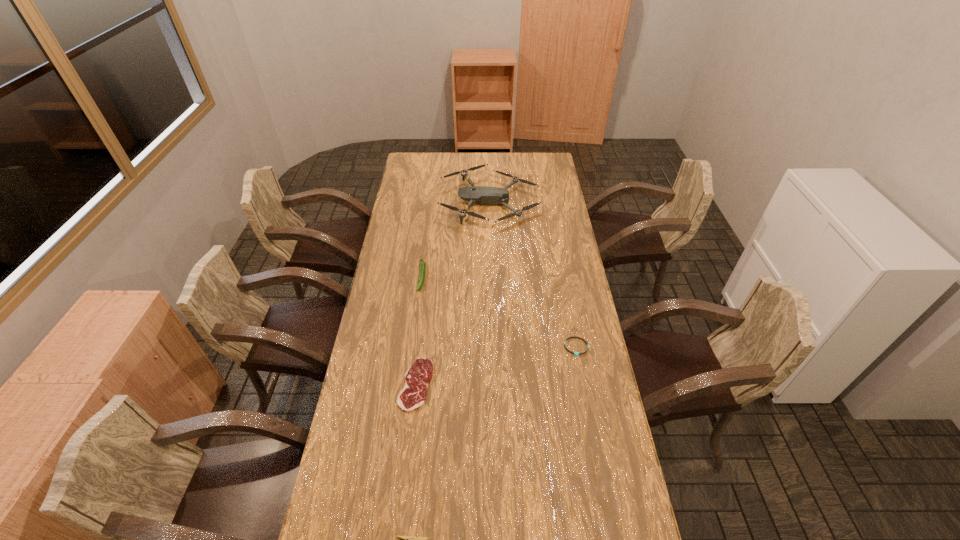
The width and height of the screenshot is (960, 540). I want to click on drone, so click(x=482, y=195).

Find the location of a particular element. This screenshot has width=960, height=540. the tallest object is located at coordinates (482, 195).

Locate an element on the screen. the second tallest object is located at coordinates (422, 264).

Where is `the fourth nearest object`? The height and width of the screenshot is (540, 960). the fourth nearest object is located at coordinates (422, 264).

The image size is (960, 540). What are the coordinates of `the second nearest object` in the screenshot? It's located at (418, 377).

Find the location of `wristband`. wristband is located at coordinates (575, 353).

Locate an element on the screen. The height and width of the screenshot is (540, 960). vacant region located 0.090m with a camera mounted on the front of the farthest object is located at coordinates (421, 202).

Find the location of a particular element. free point located 0.090m with a camera mounted on the front of the farthest object is located at coordinates (421, 202).

This screenshot has width=960, height=540. In order to click on free location located 0.070m with a camera mounted on the front of the farthest object in this screenshot , I will do `click(425, 202)`.

You are a GUI agent. You are given a task and a screenshot of the screen. Output one action in this format:
    pyautogui.click(x=<x>, y=<y>)
    Task: Click on the vacant space located on the front-facing side of the fourth nearest object
    The image size is (960, 540).
    Given the screenshot: What is the action you would take?
    pyautogui.click(x=417, y=320)